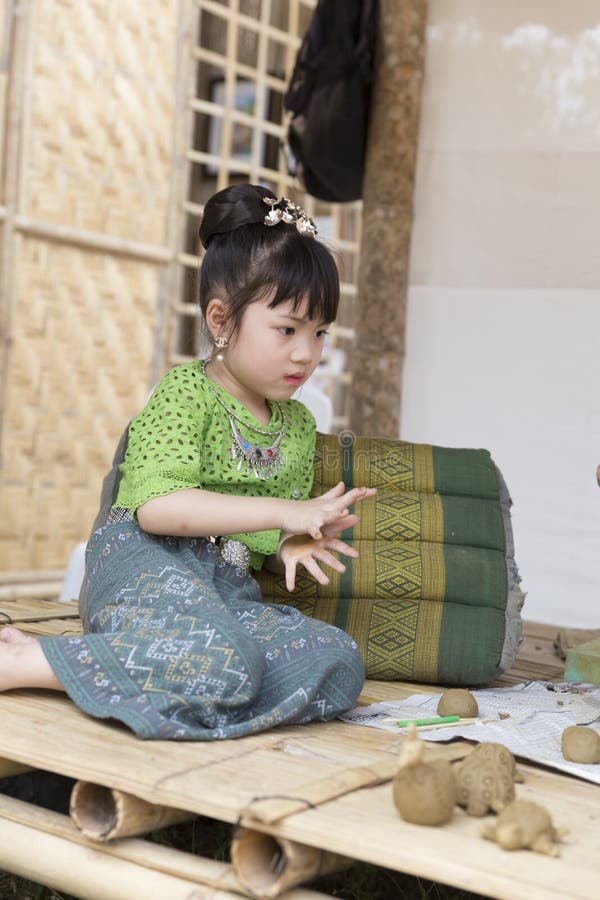
At what (x,y) coordinates should I click in order to perform the action: click on wall. Please return your answer as a coordinate pair (x, y). Looking at the image, I should click on (496, 346), (71, 321).